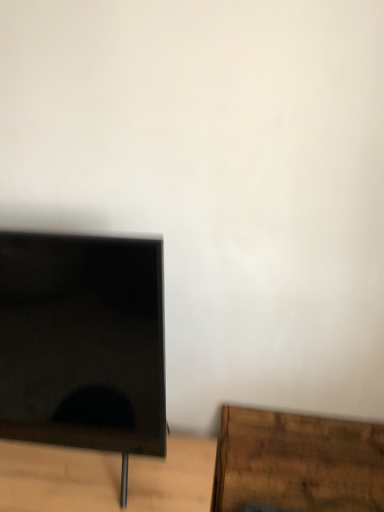
Where is `brown wood table at lower right`? The height and width of the screenshot is (512, 384). brown wood table at lower right is located at coordinates (297, 462).

The image size is (384, 512). What do you see at coordinates (82, 341) in the screenshot?
I see `black glossy monitor at left` at bounding box center [82, 341].

Locate an element on the screen. The width and height of the screenshot is (384, 512). brown wooden table at lower left is located at coordinates coord(57,479).

I want to click on brown wood table at lower right, so click(x=297, y=462).

Is brown wooden table at lower left to the left of brown wood table at lower right from the viewer's perspective?

Yes.

Considering the relative sizes of brown wooden table at lower left and brown wood table at lower right in the image provided, is brown wooden table at lower left bigger than brown wood table at lower right?

Indeed, brown wooden table at lower left has a larger size compared to brown wood table at lower right.

Which is in front, brown wooden table at lower left or brown wood table at lower right?

brown wooden table at lower left is more forward.

Is brown wood table at lower right located within brown wooden table at lower left?

Definitely not — brown wood table at lower right is not inside brown wooden table at lower left.

Does brown wooden table at lower left have a greater width compared to black glossy monitor at left?

Yes.

From the image's perspective, relative to black glossy monitor at left, is brown wooden table at lower left above or below?

brown wooden table at lower left is below black glossy monitor at left.

Which is in front, point (29, 501) or point (141, 269)?

The point (141, 269) is closer.

The image size is (384, 512). In order to click on table below the black glossy monitor at left (from the image's perspective) in this screenshot , I will do `click(57, 479)`.

From the picture: From a real-world perspective, is brown wood table at lower right positioned above or below brown wooden table at lower left?

From a real-world perspective, brown wood table at lower right is physically above brown wooden table at lower left.

Based on the photo, can you confirm if brown wood table at lower right is thinner than brown wooden table at lower left?

Indeed, brown wood table at lower right has a lesser width compared to brown wooden table at lower left.

Is brown wood table at lower right taller than brown wooden table at lower left?

Yes, brown wood table at lower right is taller than brown wooden table at lower left.

How different are the orientations of brown wood table at lower right and brown wooden table at lower left in degrees?

They differ by 0.916 degrees in their facing directions.

From a real-world perspective, does black glossy monitor at left stand above brown wood table at lower right?

Yes, from a real-world perspective, black glossy monitor at left is over brown wood table at lower right

Does black glossy monitor at left have a greater width compared to brown wood table at lower right?

Correct, the width of black glossy monitor at left exceeds that of brown wood table at lower right.

From the image's perspective, which one is positioned lower, black glossy monitor at left or brown wood table at lower right?

brown wood table at lower right, from the image's perspective.

Who is shorter, brown wood table at lower right or black glossy monitor at left?

Standing shorter between the two is brown wood table at lower right.

How far apart are brown wood table at lower right and black glossy monitor at left?

brown wood table at lower right and black glossy monitor at left are 20.16 inches apart.

Based on the photo, would you consider brown wood table at lower right to be distant from black glossy monitor at left?

Actually, brown wood table at lower right and black glossy monitor at left are a little close together.

I want to click on furniture below the black glossy monitor at left (from the image's perspective), so click(297, 462).

From a real-world perspective, which is physically below, black glossy monitor at left or brown wooden table at lower left?

brown wooden table at lower left is physically lower.

Considering the relative sizes of black glossy monitor at left and brown wooden table at lower left in the image provided, is black glossy monitor at left taller than brown wooden table at lower left?

Indeed, black glossy monitor at left has a greater height compared to brown wooden table at lower left.

Is black glossy monitor at left looking in the opposite direction of brown wooden table at lower left?

No, black glossy monitor at left is not facing the opposite direction of brown wooden table at lower left.

Does point (26, 372) appear closer or farther from the camera than point (88, 510)?

Point (26, 372) is positioned closer to the camera compared to point (88, 510).

Where is `furniture located above the brown wooden table at lower left (from the image's perspective)`? This screenshot has height=512, width=384. furniture located above the brown wooden table at lower left (from the image's perspective) is located at coordinates (297, 462).

You are a GUI agent. You are given a task and a screenshot of the screen. Output one action in this format:
    pyautogui.click(x=<x>, y=<y>)
    Task: Click on the table lying behind the black glossy monitor at left
    The height and width of the screenshot is (512, 384).
    Given the screenshot: What is the action you would take?
    pyautogui.click(x=57, y=479)

When comparing their distances from brown wooden table at lower left, does black glossy monitor at left or brown wood table at lower right seem closer?

black glossy monitor at left lies closer to brown wooden table at lower left than the other object.

Based on their spatial positions, is brown wood table at lower right or black glossy monitor at left closer to brown wooden table at lower left?

black glossy monitor at left is closer to brown wooden table at lower left.

Looking at this image, estimate the real-world distances between objects in this image. Which object is further from black glossy monitor at left, brown wooden table at lower left or brown wood table at lower right?

brown wood table at lower right is positioned further to the anchor black glossy monitor at left.

Considering their positions, is black glossy monitor at left positioned further to brown wood table at lower right than brown wooden table at lower left?

black glossy monitor at left is further to brown wood table at lower right.

Looking at the image, which one is located further to black glossy monitor at left, brown wood table at lower right or brown wooden table at lower left?

Based on the image, brown wood table at lower right appears to be further to black glossy monitor at left.

Based on their spatial positions, is brown wooden table at lower left or black glossy monitor at left closer to brown wood table at lower right?

Among the two, brown wooden table at lower left is located nearer to brown wood table at lower right.

You are a GUI agent. You are given a task and a screenshot of the screen. Output one action in this format:
    pyautogui.click(x=<x>, y=<y>)
    Task: Click on the table located between black glossy monitor at left and brown wood table at lower right in the left-right direction
    The width and height of the screenshot is (384, 512).
    Given the screenshot: What is the action you would take?
    pyautogui.click(x=57, y=479)